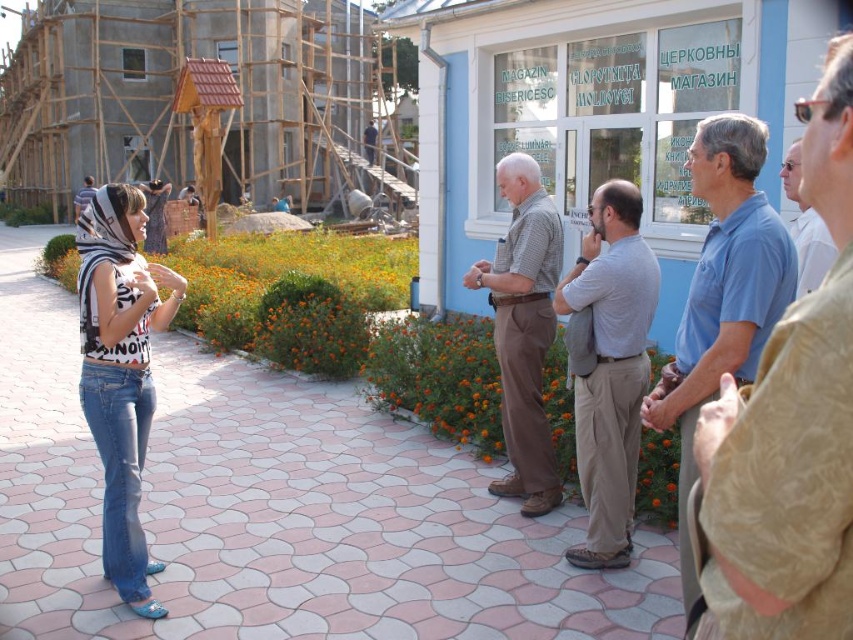
You are a tailor measuring two customers for new outfits. The first customer is wearing a blue cotton shirt at right, and the second is wearing denim jeans at left. Which garment has a greater width measurement?

The blue cotton shirt at right has a greater width than the denim jeans at left, as stated in the description.

You are a photographer setting up a tripod to capture a group photo of the people wearing the blue cotton shirt at right and the white shirt at right. The tripod has a width of 1.2 meters. If the shirts are positioned side by side, will the tripod fit between them without overlapping?

The blue cotton shirt at right might be wider than white shirt at right, but since the exact width difference isn not specified, it is uncertain whether the 1.2 meter tripod will fit between them. Additional measurements are needed to determine this.

You are standing at point [787,172] and want to walk to the light blue building with white framed windows. Is the point [675,394] between you and the building?

Yes, the point [675,394] is between you and the light blue building with white framed windows because it is in front of point [787,172] where you are standing.